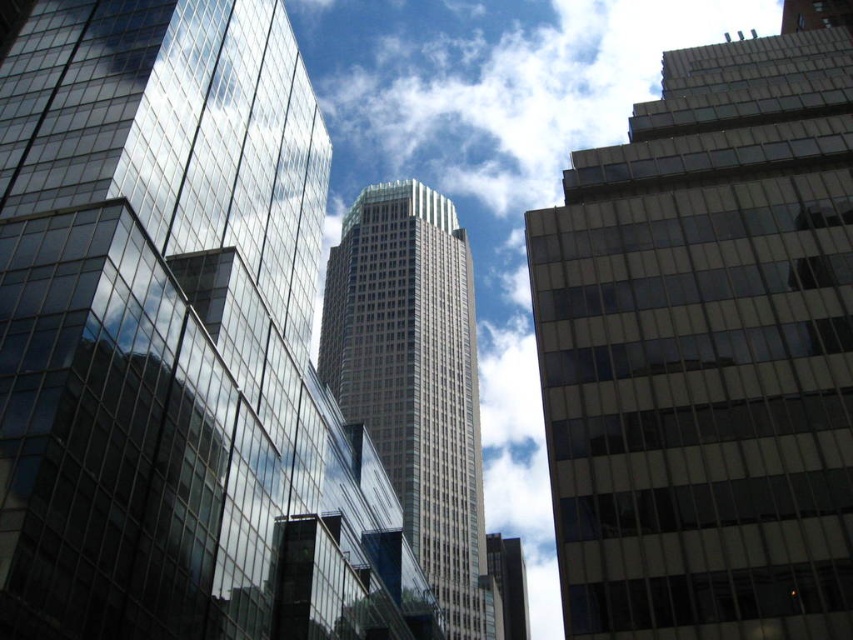
Question: Which point is closer to the camera taking this photo?

Choices:
 (A) (492, 554)
 (B) (479, 628)

Answer: (B)

Question: Does white fluffy cloud at center appear on the left side of beige glass skyscraper at center?

Choices:
 (A) yes
 (B) no

Answer: (B)

Question: From the image, what is the correct spatial relationship of white fluffy cloud at center in relation to beige glass skyscraper at center?

Choices:
 (A) above
 (B) below

Answer: (A)

Question: Which point is closer to the camera?

Choices:
 (A) (346, 93)
 (B) (502, 561)

Answer: (B)

Question: Does white fluffy cloud at center appear on the left side of smooth glass skyscraper at center?

Choices:
 (A) no
 (B) yes

Answer: (A)

Question: Which object is positioned farthest from the matte glass building at right?

Choices:
 (A) beige glass skyscraper at center
 (B) smooth glass skyscraper at center
 (C) white fluffy cloud at center

Answer: (C)